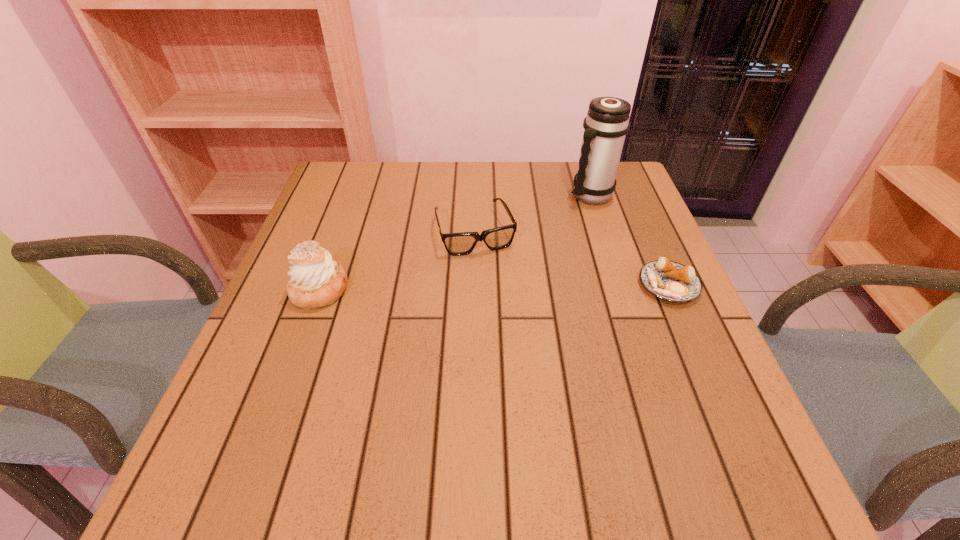
Where is `vacant space on the desktop that is between the leftmost object and the shorter pastry and is positioned on the front-facing side of the third tallest object`? This screenshot has width=960, height=540. vacant space on the desktop that is between the leftmost object and the shorter pastry and is positioned on the front-facing side of the third tallest object is located at coordinates (495, 287).

The image size is (960, 540). I want to click on free space on the desktop that is between the taller pastry and the shortest object and is positioned on the side with the handle of the thermos bottle, so click(499, 287).